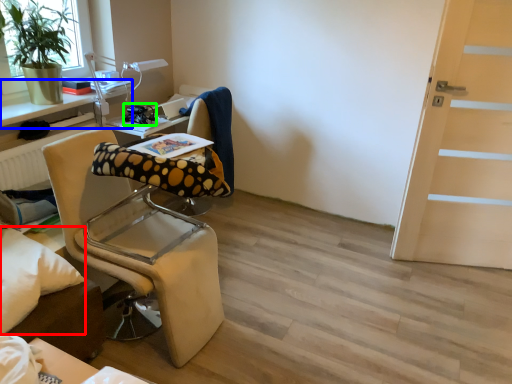
Question: Considering the real-world distances, which object is farthest from pillow (highlighted by a red box)? table (highlighted by a blue box) or equipment (highlighted by a green box)?

Choices:
 (A) table
 (B) equipment

Answer: (B)